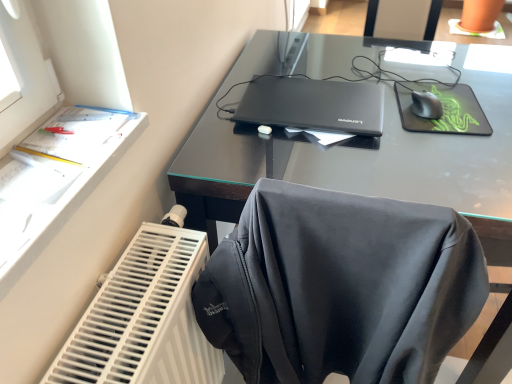
Identify the location of black matte laptop at center. (313, 105).

In order to click on black matte mouse at upper right in this screenshot , I will do `click(426, 105)`.

I want to click on white plastic radiator at lower left, so click(144, 316).

Can you tell me how much black matte laptop at center and black glass desk at center differ in facing direction?

The angular difference between black matte laptop at center and black glass desk at center is 89.1 degrees.

From the image's perspective, is black matte laptop at center located above or below black glass desk at center?

black matte laptop at center is situated higher than black glass desk at center in the image.

Locate an element on the screen. Image resolution: width=512 pixels, height=384 pixels. desk on the right of black matte laptop at center is located at coordinates (358, 167).

Considering the relative positions of black matte laptop at center and black glass desk at center in the image provided, is black matte laptop at center to the left or to the right of black glass desk at center?

black matte laptop at center is to the left of black glass desk at center.

Is point (200, 253) positioned behind point (366, 84)?

No, (200, 253) is in front of (366, 84).

Is white plastic radiator at lower left positioned with its back to black matte laptop at center?

No, white plastic radiator at lower left is not facing away from black matte laptop at center.

Can you confirm if white plastic radiator at lower left is smaller than black matte laptop at center?

Incorrect, white plastic radiator at lower left is not smaller in size than black matte laptop at center.

From the image's perspective, does black matte laptop at center appear lower than green matte mousepad at upper right?

No.

Is black matte laptop at center turned away from green matte mousepad at upper right?

That's not correct — black matte laptop at center is not looking away from green matte mousepad at upper right.

Between black matte laptop at center and green matte mousepad at upper right, which one appears on the right side from the viewer's perspective?

From the viewer's perspective, green matte mousepad at upper right appears more on the right side.

The width and height of the screenshot is (512, 384). I want to click on mousepad below the black matte laptop at center (from a real-world perspective), so click(x=444, y=110).

Can black matte laptop at center be found inside black glass desk at center?

Yes, black glass desk at center contains black matte laptop at center.

From the image's perspective, is black glass desk at center located above black matte laptop at center?

No, from the image's perspective, black glass desk at center is not on top of black matte laptop at center.

Is black glass desk at center thinner than black matte laptop at center?

In fact, black glass desk at center might be wider than black matte laptop at center.

How different are the orientations of black matte mouse at upper right and white plastic radiator at lower left in degrees?

77.9 degrees.

Is black matte mouse at upper right to the right of white plastic radiator at lower left from the viewer's perspective?

Yes, black matte mouse at upper right is to the right of white plastic radiator at lower left.

From the image's perspective, is black matte mouse at upper right beneath white plastic radiator at lower left?

No.

You are a GUI agent. You are given a task and a screenshot of the screen. Output one action in this format:
    pyautogui.click(x=<x>, y=<y>)
    Task: Click on the laptop above the white plastic radiator at lower left (from a real-world perspective)
    The height and width of the screenshot is (384, 512).
    Given the screenshot: What is the action you would take?
    pyautogui.click(x=313, y=105)

Which is behind, point (271, 124) or point (97, 352)?

Positioned behind is point (271, 124).

From a real-world perspective, is black matte laptop at center over white plastic radiator at lower left?

Yes.

Is black matte laptop at center closer to the viewer compared to white plastic radiator at lower left?

No, it is not.

Looking at this image, considering the relative sizes of black matte mouse at upper right and green matte mousepad at upper right in the image provided, is black matte mouse at upper right thinner than green matte mousepad at upper right?

Yes.

Considering the points (423, 117) and (461, 97), which point is behind, point (423, 117) or point (461, 97)?

The point (461, 97) is behind.

How many degrees apart are the facing directions of black matte mouse at upper right and green matte mousepad at upper right?

0.000102 degrees separate the facing orientations of black matte mouse at upper right and green matte mousepad at upper right.

From a real-world perspective, is black matte mouse at upper right positioned above or below green matte mousepad at upper right?

In terms of real-world spatial position, black matte mouse at upper right is above green matte mousepad at upper right.

Find the location of `laptop behind the black glass desk at center`. laptop behind the black glass desk at center is located at coordinates (313, 105).

The height and width of the screenshot is (384, 512). I want to click on radiator that appears below the black matte laptop at center (from the image's perspective), so click(x=144, y=316).

When comparing their distances from black matte mouse at upper right, does black glass desk at center or white plastic radiator at lower left seem further?

Among the two, white plastic radiator at lower left is located further to black matte mouse at upper right.

Based on their spatial positions, is black matte mouse at upper right or black glass desk at center closer to black matte laptop at center?

black glass desk at center is positioned closer to the anchor black matte laptop at center.

Estimate the real-world distances between objects in this image. Which object is further from black glass desk at center, green matte mousepad at upper right or black matte laptop at center?

The object further to black glass desk at center is green matte mousepad at upper right.

Estimate the real-world distances between objects in this image. Which object is further from black matte laptop at center, green matte mousepad at upper right or black matte mouse at upper right?

black matte mouse at upper right.

Considering their positions, is green matte mousepad at upper right positioned closer to black matte laptop at center than white plastic radiator at lower left?

green matte mousepad at upper right lies closer to black matte laptop at center than the other object.

Which object lies further to the anchor point black matte mouse at upper right, black glass desk at center or green matte mousepad at upper right?

Among the two, black glass desk at center is located further to black matte mouse at upper right.

From the image, which object appears to be farther from green matte mousepad at upper right, black matte mouse at upper right or black matte laptop at center?

The object further to green matte mousepad at upper right is black matte laptop at center.

From the image, which object appears to be farther from black matte laptop at center, black glass desk at center or black matte mouse at upper right?

Based on the image, black matte mouse at upper right appears to be further to black matte laptop at center.

At what (x,y) coordinates should I click in order to perform the action: click on desk located between white plastic radiator at lower left and green matte mousepad at upper right in the left-right direction. Please return your answer as a coordinate pair (x, y). The width and height of the screenshot is (512, 384). Looking at the image, I should click on (358, 167).

Locate an element on the screen. The image size is (512, 384). mouse situated between white plastic radiator at lower left and green matte mousepad at upper right from left to right is located at coordinates (426, 105).

This screenshot has height=384, width=512. In order to click on desk between white plastic radiator at lower left and black matte mouse at upper right in this screenshot , I will do `click(358, 167)`.

Find the location of a particular element. This screenshot has height=384, width=512. desk situated between black matte laptop at center and black matte mouse at upper right from left to right is located at coordinates pyautogui.click(x=358, y=167).